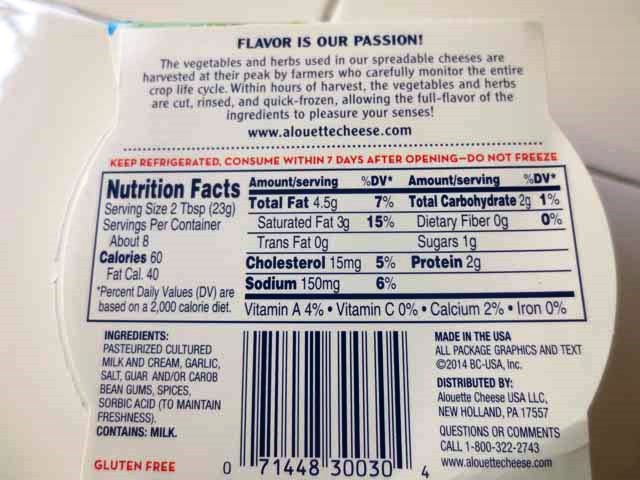
At what (x,y) coordinates should I click in order to perform the action: click on white tiled floor. Please return your answer as a coordinate pair (x, y). The height and width of the screenshot is (480, 640). Looking at the image, I should click on (27, 121).